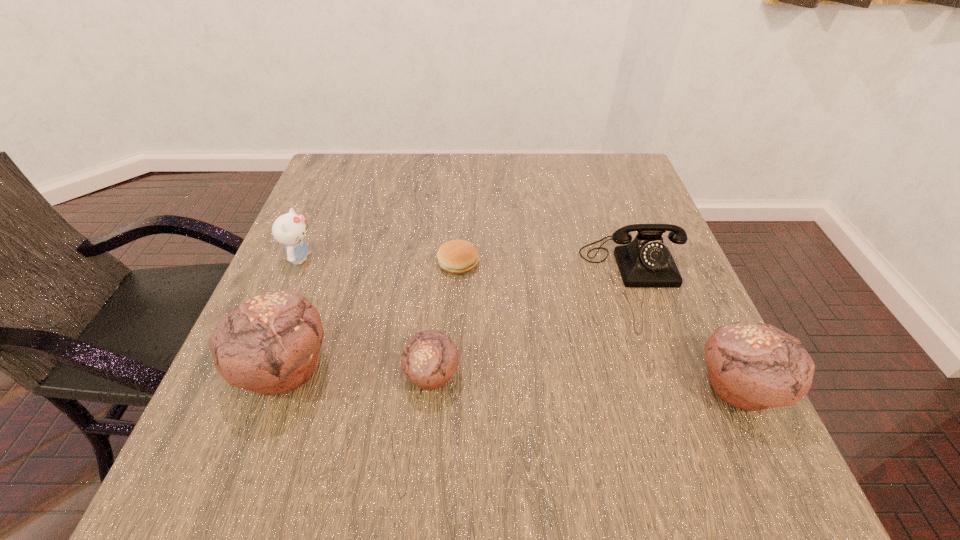
The height and width of the screenshot is (540, 960). Identify the location of blank area located 0.210m on the front face of the telephone. (670, 373).

You are a GUI agent. You are given a task and a screenshot of the screen. Output one action in this format:
    pyautogui.click(x=<x>, y=<y>)
    Task: Click on the vacant space located 0.160m on the front-facing side of the kitten
    
    Given the screenshot: What is the action you would take?
    coord(386,258)

This screenshot has width=960, height=540. I want to click on muffin that is at the left edge, so click(270, 344).

Locate an element on the screen. This screenshot has width=960, height=540. kitten present at the left edge is located at coordinates (289, 229).

Find the location of a particular element. This screenshot has width=960, height=540. muffin present at the right edge is located at coordinates (751, 366).

At what (x,y) coordinates should I click in order to perform the action: click on telephone situated at the right edge. Please return your answer as a coordinate pair (x, y). Looking at the image, I should click on (646, 262).

The height and width of the screenshot is (540, 960). I want to click on object that is at the near left corner, so click(x=270, y=344).

Identify the location of object present at the near right corner. (751, 366).

The image size is (960, 540). I want to click on vacant area at the far edge of the desktop, so click(x=397, y=180).

In the image, there is a desktop. In order to click on vacant space at the near edge in this screenshot , I will do `click(527, 410)`.